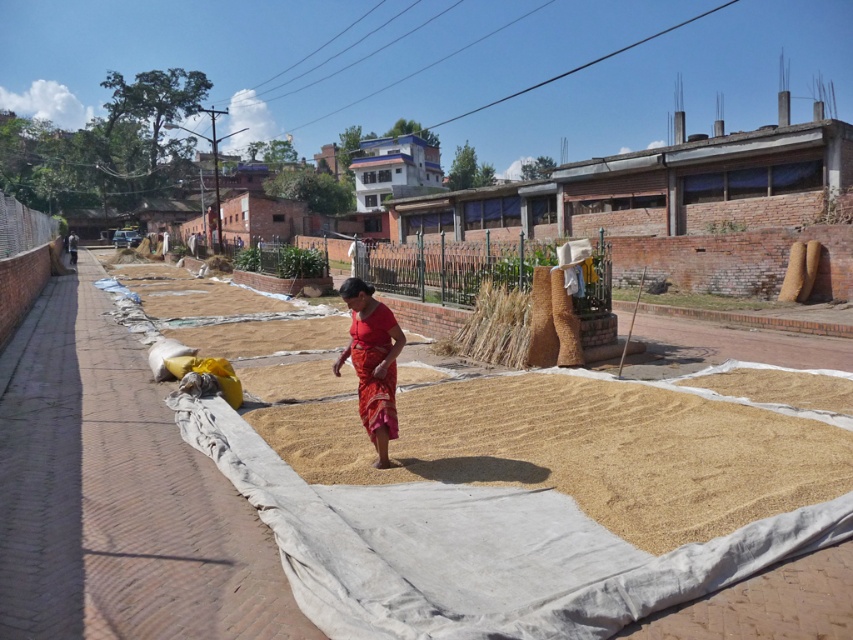
Question: Which object is positioned farthest from the brown straw at center?

Choices:
 (A) brown grain at center
 (B) red cotton saree at center

Answer: (B)

Question: Can you confirm if brown grain at center is positioned above brown straw at center?

Choices:
 (A) no
 (B) yes

Answer: (A)

Question: Estimate the real-world distances between objects in this image. Which object is closer to the red cotton saree at center?

Choices:
 (A) brown straw at center
 (B) brown grain at center

Answer: (B)

Question: Among these objects, which one is nearest to the camera?

Choices:
 (A) brown grain at center
 (B) brown straw at center

Answer: (A)

Question: Is brown grain at center to the left of brown straw at center from the viewer's perspective?

Choices:
 (A) yes
 (B) no

Answer: (B)

Question: Is brown grain at center smaller than red cotton saree at center?

Choices:
 (A) no
 (B) yes

Answer: (A)